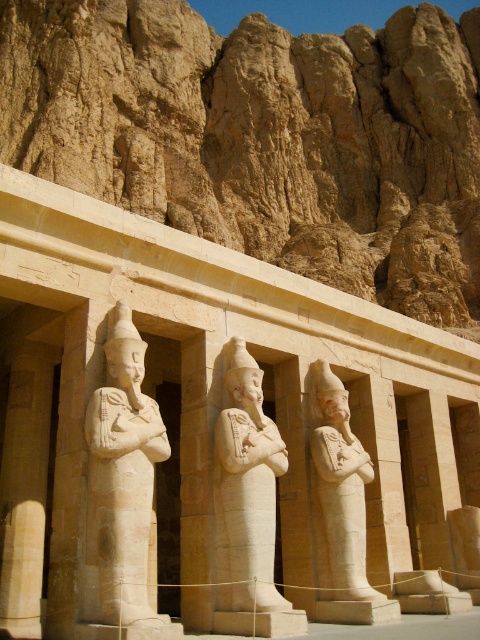
Question: From the image, what is the correct spatial relationship of beige stone statue at center in relation to white stone statue at center?

Choices:
 (A) below
 (B) above

Answer: (B)

Question: Can you confirm if beige stone rock formation at upper center is positioned above smooth beige statue at center?

Choices:
 (A) no
 (B) yes

Answer: (B)

Question: Among these objects, which one is nearest to the camera?

Choices:
 (A) beige stone statue at center
 (B) white stone statue at center

Answer: (A)

Question: Which of the following is the farthest from the observer?

Choices:
 (A) smooth beige statue at center
 (B) white stone statue at center
 (C) beige stone statue at center

Answer: (B)

Question: Among these points, which one is farthest from the camera?

Choices:
 (A) (94, 509)
 (B) (201, 70)

Answer: (B)

Question: Observing the image, what is the correct spatial positioning of beige stone rock formation at upper center in reference to smooth beige statue at center?

Choices:
 (A) below
 (B) above

Answer: (B)